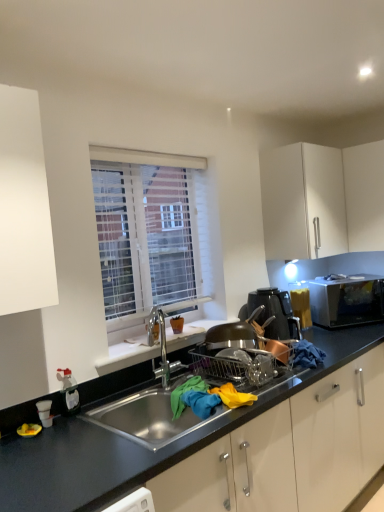
Question: Does white matte cabinet at upper right have a greater height compared to stainless steel sink at center?

Choices:
 (A) no
 (B) yes

Answer: (B)

Question: Is the position of white matte cabinet at upper right less distant than that of stainless steel sink at center?

Choices:
 (A) yes
 (B) no

Answer: (B)

Question: Is white matte cabinet at upper right behind stainless steel sink at center?

Choices:
 (A) yes
 (B) no

Answer: (A)

Question: Would you say white matte cabinet at upper right is a long distance from stainless steel sink at center?

Choices:
 (A) yes
 (B) no

Answer: (A)

Question: Would you say white matte cabinet at upper right contains stainless steel sink at center?

Choices:
 (A) no
 (B) yes

Answer: (A)

Question: From the image's perspective, is white matte cabinet at upper right located beneath stainless steel sink at center?

Choices:
 (A) yes
 (B) no

Answer: (B)

Question: Can you confirm if stainless steel sink at center is shorter than white textured blinds at upper center?

Choices:
 (A) yes
 (B) no

Answer: (A)

Question: From the image's perspective, is stainless steel sink at center located above white textured blinds at upper center?

Choices:
 (A) no
 (B) yes

Answer: (A)

Question: Does stainless steel sink at center have a smaller size compared to white textured blinds at upper center?

Choices:
 (A) no
 (B) yes

Answer: (A)

Question: Does stainless steel sink at center come behind white textured blinds at upper center?

Choices:
 (A) yes
 (B) no

Answer: (B)

Question: Considering the relative sizes of stainless steel sink at center and white textured blinds at upper center in the image provided, is stainless steel sink at center taller than white textured blinds at upper center?

Choices:
 (A) yes
 (B) no

Answer: (B)

Question: Is white textured blinds at upper center surrounded by stainless steel sink at center?

Choices:
 (A) no
 (B) yes

Answer: (A)

Question: Can you confirm if stainless steel sink at center is positioned to the right of metallic copper pot at right?

Choices:
 (A) yes
 (B) no

Answer: (B)